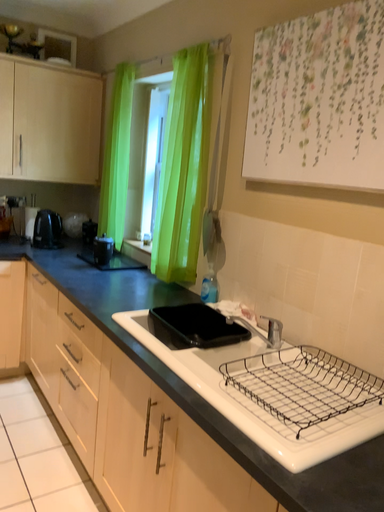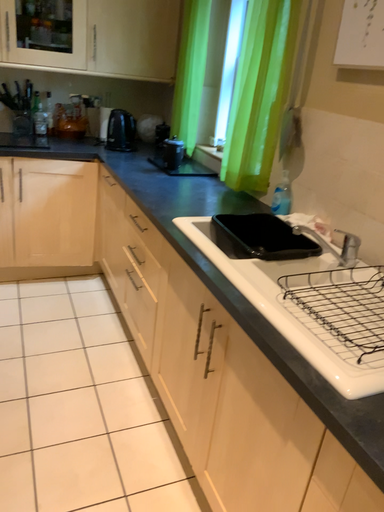
Question: Which way did the camera rotate in the video?

Choices:
 (A) rotated left
 (B) rotated right

Answer: (A)